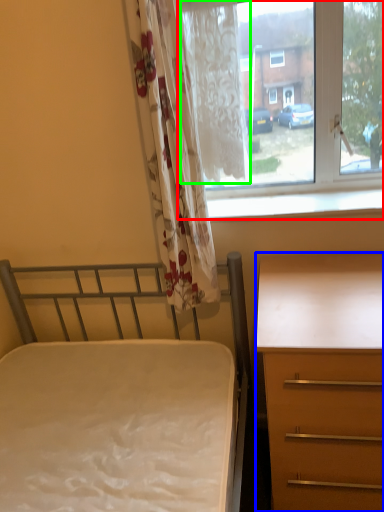
Question: Which object is positioned closest to window (highlighted by a red box)? Select from desk (highlighted by a blue box) and curtain (highlighted by a green box).

Choices:
 (A) desk
 (B) curtain

Answer: (B)